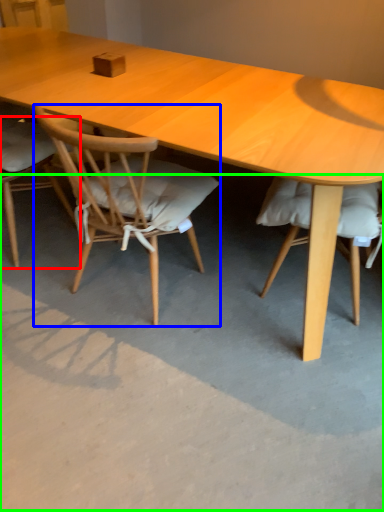
Question: Which object is the farthest from chair (highlighted by a red box)? Choose among these: chair (highlighted by a blue box) or concrete (highlighted by a green box).

Choices:
 (A) chair
 (B) concrete

Answer: (B)